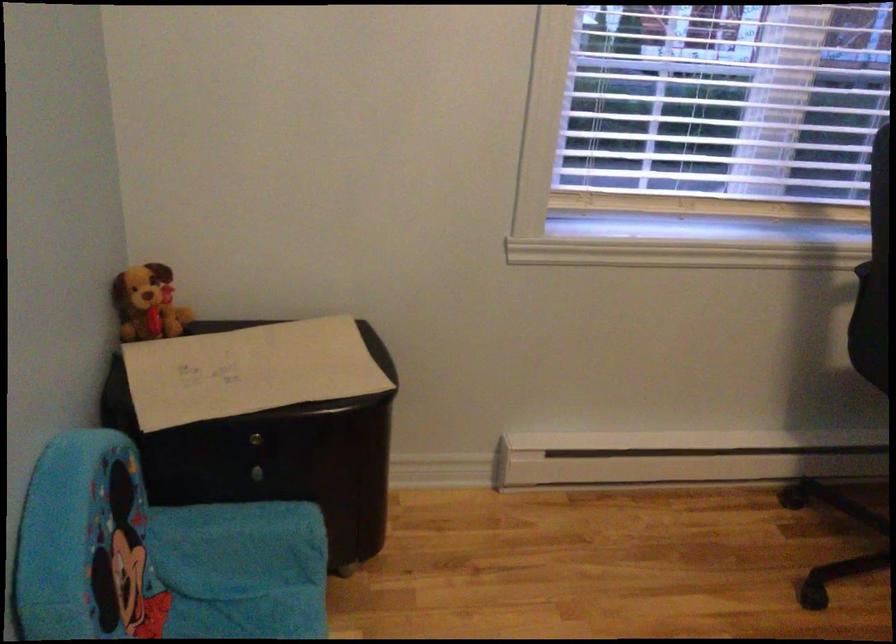
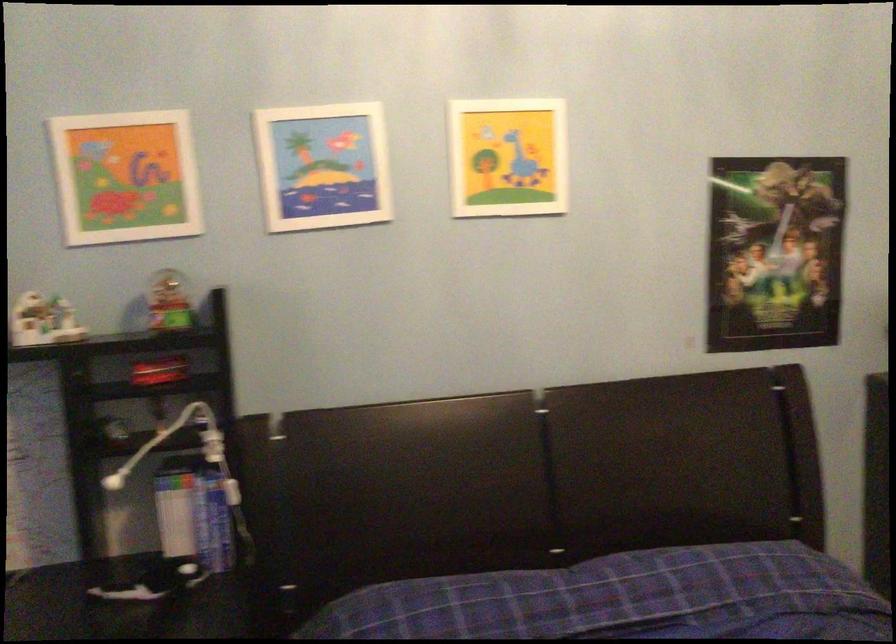
Question: The camera is either moving clockwise (left) or counter-clockwise (right) around the object. The first image is from the beginning of the video and the second image is from the end. Is the camera moving left or right when shooting the video?

Choices:
 (A) Left
 (B) Right

Answer: (A)